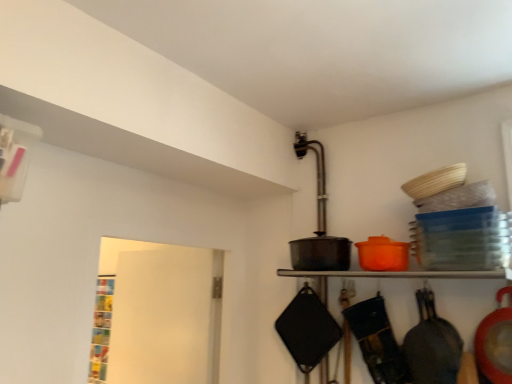
Question: Is black matte frying pan at lower right, marked as the second frying pan in a right-to-left arrangement, positioned before matte black pot at center?

Choices:
 (A) yes
 (B) no

Answer: (B)

Question: Can you confirm if black matte frying pan at lower right, placed as the 1th frying pan when sorted from left to right, is taller than matte black pot at center?

Choices:
 (A) yes
 (B) no

Answer: (A)

Question: Does black matte frying pan at lower right, placed as the 1th frying pan when sorted from left to right, appear on the right side of matte black pot at center?

Choices:
 (A) no
 (B) yes

Answer: (A)

Question: Is matte black pot at center at the back of black matte frying pan at lower right, placed as the 1th frying pan when sorted from left to right?

Choices:
 (A) no
 (B) yes

Answer: (A)

Question: Considering the relative sizes of black matte frying pan at lower right, marked as the second frying pan in a right-to-left arrangement, and matte black pot at center in the image provided, is black matte frying pan at lower right, marked as the second frying pan in a right-to-left arrangement, shorter than matte black pot at center?

Choices:
 (A) no
 (B) yes

Answer: (A)

Question: Does black matte frying pan at lower right, marked as the second frying pan in a right-to-left arrangement, have a larger size compared to matte black pot at center?

Choices:
 (A) yes
 (B) no

Answer: (A)

Question: Does white matte door at left have a lesser width compared to matte black pot at center?

Choices:
 (A) yes
 (B) no

Answer: (A)

Question: Is white matte door at left placed right next to matte black pot at center?

Choices:
 (A) no
 (B) yes

Answer: (A)

Question: Is white matte door at left positioned with its back to matte black pot at center?

Choices:
 (A) yes
 (B) no

Answer: (B)

Question: From the image's perspective, is white matte door at left located beneath matte black pot at center?

Choices:
 (A) no
 (B) yes

Answer: (B)

Question: Does white matte door at left come behind matte black pot at center?

Choices:
 (A) no
 (B) yes

Answer: (B)

Question: From a real-world perspective, does white matte door at left sit lower than matte black pot at center?

Choices:
 (A) no
 (B) yes

Answer: (B)

Question: Is matte black frying pan at right, which is the first frying pan from right to left, surrounding black matte frying pan at lower right, marked as the second frying pan in a right-to-left arrangement?

Choices:
 (A) no
 (B) yes

Answer: (A)